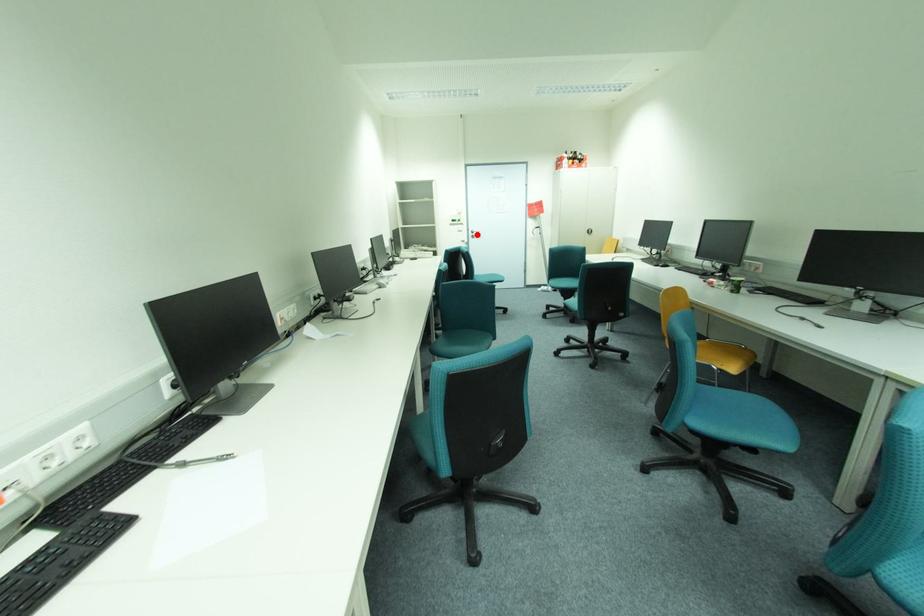
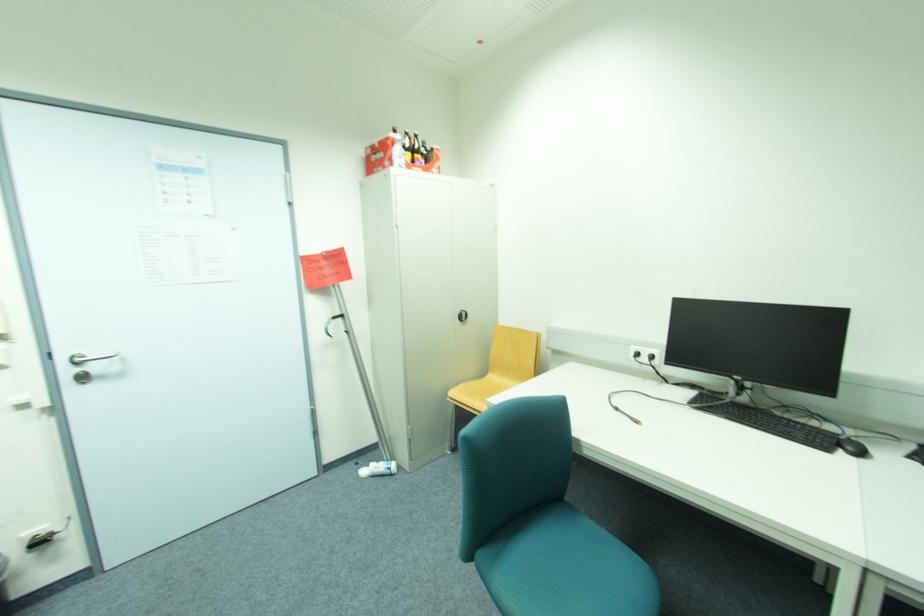
Find the pixel in the second image that matches the highlighted location in the first image.

(74, 371)